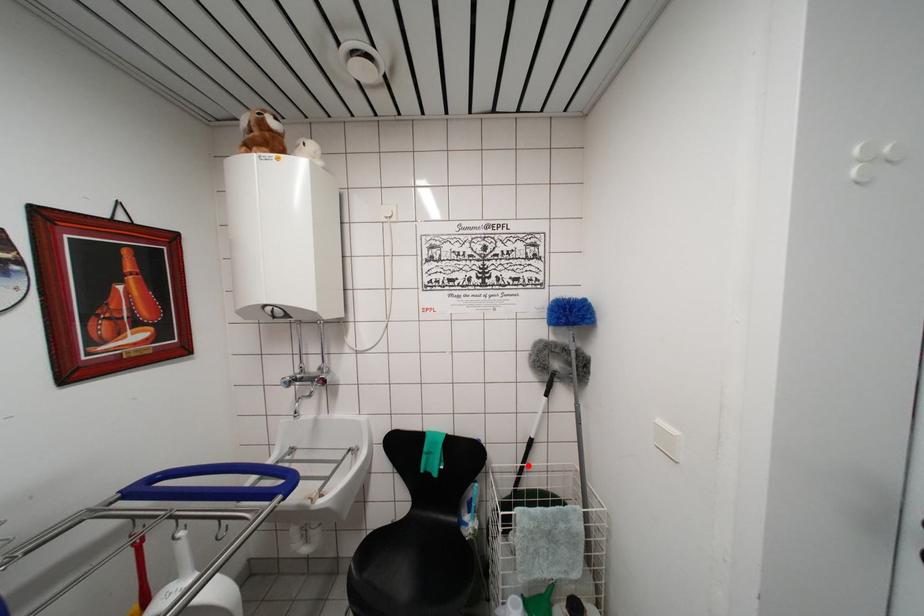
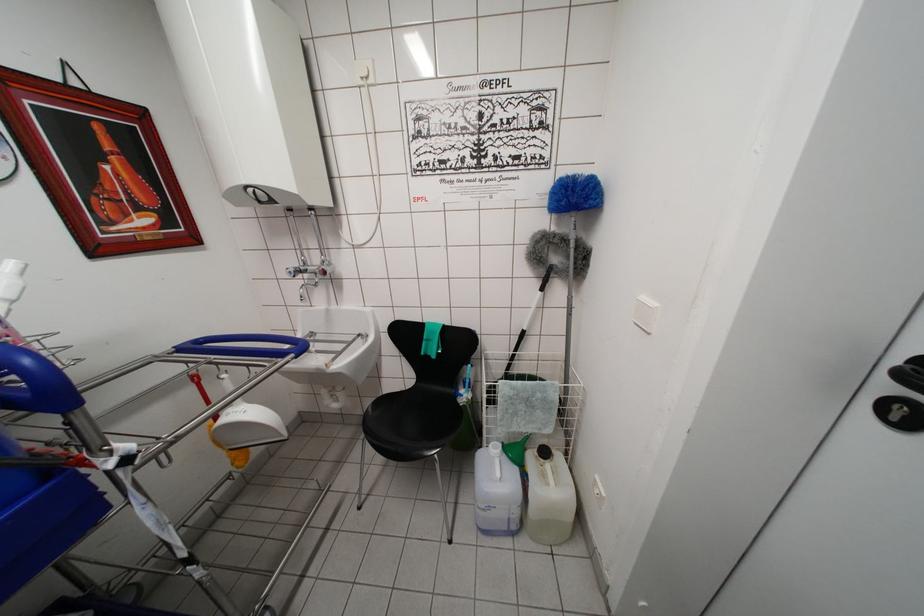
Where in the second image is the point corresponding to the highlighted location from the first image?

(518, 354)